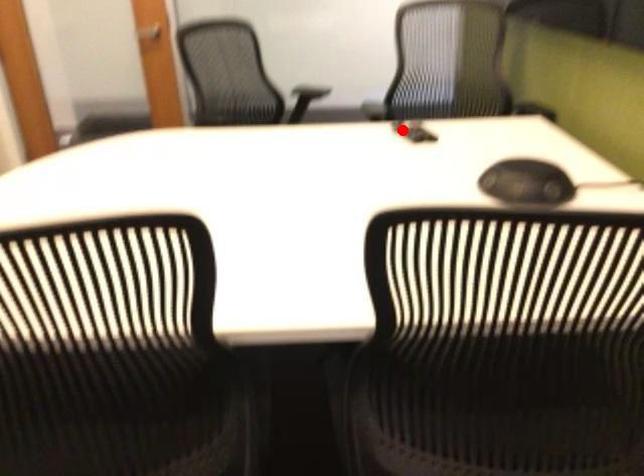
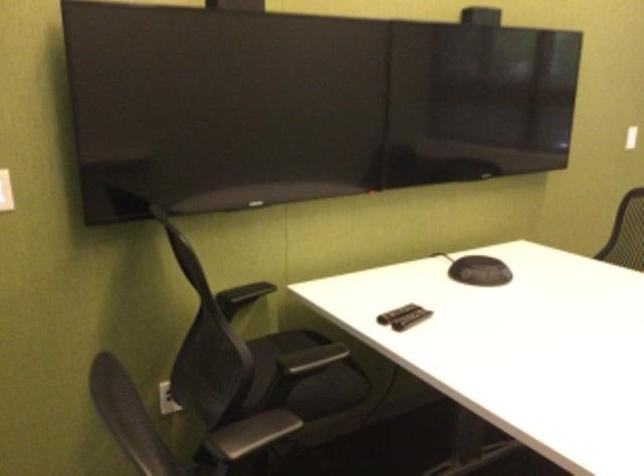
Question: I am providing you with two images of the same scene from different viewpoints. A red point is marked on the first image. At the location where the point appears in image 1, is it still visible in image 2?

Choices:
 (A) Yes
 (B) No

Answer: (A)